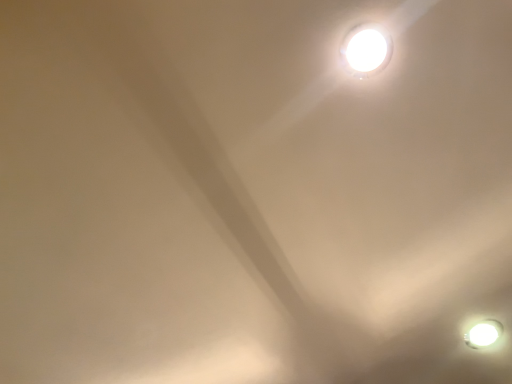
What do you see at coordinates (366, 50) in the screenshot? I see `white glossy light fixture at upper right` at bounding box center [366, 50].

Locate an element on the screen. white glossy light fixture at upper right is located at coordinates 366,50.

Locate an element on the screen. Image resolution: width=512 pixels, height=384 pixels. white glossy light fixture at upper right is located at coordinates (366, 50).